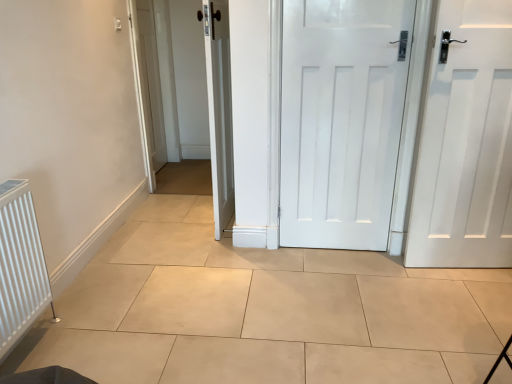
This screenshot has width=512, height=384. Describe the element at coordinates (219, 109) in the screenshot. I see `white wooden door at center, which is counted as the 3th door, starting from the right` at that location.

Find the location of `white matte door at center, the 2th door from the right`. white matte door at center, the 2th door from the right is located at coordinates (341, 120).

The height and width of the screenshot is (384, 512). What do you see at coordinates (20, 265) in the screenshot?
I see `white ribbed radiator at left` at bounding box center [20, 265].

You are a GUI agent. You are given a task and a screenshot of the screen. Output one action in this format:
    pyautogui.click(x=<x>, y=<y>)
    Task: Click on the white matte door at right, which is the 1th door in right-to-left order
    The height and width of the screenshot is (384, 512).
    Given the screenshot: What is the action you would take?
    pyautogui.click(x=465, y=141)

From the picture: Considering the relative sizes of white matte door at right, which is the 1th door in right-to-left order, and white wooden door at center, the 1th door in the left-to-right sequence, in the image provided, is white matte door at right, which is the 1th door in right-to-left order, shorter than white wooden door at center, the 1th door in the left-to-right sequence,?

Correct, white matte door at right, which is the 1th door in right-to-left order, is not as tall as white wooden door at center, the 1th door in the left-to-right sequence.

Which object is wider, white matte door at right, placed as the third door when sorted from left to right, or white wooden door at center, which is counted as the 3th door, starting from the right?

white wooden door at center, which is counted as the 3th door, starting from the right.

Would you say white matte door at right, which is the 1th door in right-to-left order, is inside or outside white wooden door at center, the 1th door in the left-to-right sequence?

white matte door at right, which is the 1th door in right-to-left order, cannot be found inside white wooden door at center, the 1th door in the left-to-right sequence.

Is white ribbed radiator at left smaller than white matte door at center, marked as the second door in a left-to-right arrangement?

Indeed, white ribbed radiator at left has a smaller size compared to white matte door at center, marked as the second door in a left-to-right arrangement.

From the image's perspective, between white ribbed radiator at left and white matte door at center, marked as the second door in a left-to-right arrangement, which one is located above?

white matte door at center, marked as the second door in a left-to-right arrangement, appears higher in the image.

Who is more distant, white ribbed radiator at left or white matte door at center, marked as the second door in a left-to-right arrangement?

white matte door at center, marked as the second door in a left-to-right arrangement, is behind.

Which object is positioned more to the left, white matte door at right, which is the 1th door in right-to-left order, or white matte door at center, the 2th door from the right?

From the viewer's perspective, white matte door at center, the 2th door from the right, appears more on the left side.

Is white matte door at right, which is the 1th door in right-to-left order, wider or thinner than white matte door at center, marked as the second door in a left-to-right arrangement?

white matte door at right, which is the 1th door in right-to-left order, is wider than white matte door at center, marked as the second door in a left-to-right arrangement.

From the image's perspective, is white matte door at right, which is the 1th door in right-to-left order, on white matte door at center, marked as the second door in a left-to-right arrangement?

Incorrect, from the image's perspective, white matte door at right, which is the 1th door in right-to-left order, is lower than white matte door at center, marked as the second door in a left-to-right arrangement.

Which door is the 3rd one when counting from the back of the white ribbed radiator at left? Please provide its 2D coordinates.

[(219, 109)]

Based on their positions, is white ribbed radiator at left located to the left or right of white wooden door at center, which is counted as the 3th door, starting from the right?

Clearly, white ribbed radiator at left is on the left of white wooden door at center, which is counted as the 3th door, starting from the right, in the image.

Is white ribbed radiator at left wider or thinner than white wooden door at center, the 1th door in the left-to-right sequence?

In the image, white ribbed radiator at left appears to be more narrow than white wooden door at center, the 1th door in the left-to-right sequence.

From a real-world perspective, is white ribbed radiator at left physically located above or below white wooden door at center, the 1th door in the left-to-right sequence?

white ribbed radiator at left is below white wooden door at center, the 1th door in the left-to-right sequence.

Consider the image. Considering the relative positions of white matte door at right, which is the 1th door in right-to-left order, and white ribbed radiator at left in the image provided, is white matte door at right, which is the 1th door in right-to-left order, to the left or to the right of white ribbed radiator at left?

From the image, it's evident that white matte door at right, which is the 1th door in right-to-left order, is to the right of white ribbed radiator at left.

Who is bigger, white matte door at right, placed as the third door when sorted from left to right, or white ribbed radiator at left?

white matte door at right, placed as the third door when sorted from left to right, is bigger.

Looking at this image, considering the sizes of objects white matte door at right, placed as the third door when sorted from left to right, and white ribbed radiator at left in the image provided, who is shorter, white matte door at right, placed as the third door when sorted from left to right, or white ribbed radiator at left?

With less height is white ribbed radiator at left.

Is white ribbed radiator at left bigger or smaller than white matte door at right, which is the 1th door in right-to-left order?

Considering their sizes, white ribbed radiator at left takes up less space than white matte door at right, which is the 1th door in right-to-left order.

Would you say white ribbed radiator at left is inside or outside white matte door at right, placed as the third door when sorted from left to right?

The correct answer is: outside.

Could you measure the distance between white ribbed radiator at left and white matte door at right, which is the 1th door in right-to-left order?

They are 2.09 meters apart.

Is white ribbed radiator at left to the left of white matte door at right, which is the 1th door in right-to-left order, from the viewer's perspective?

Correct, you'll find white ribbed radiator at left to the left of white matte door at right, which is the 1th door in right-to-left order.

Consider the image. Is white wooden door at center, which is counted as the 3th door, starting from the right, inside the boundaries of white matte door at center, the 2th door from the right, or outside?

white wooden door at center, which is counted as the 3th door, starting from the right, is outside white matte door at center, the 2th door from the right.

Considering their positions, is white wooden door at center, the 1th door in the left-to-right sequence, located in front of or behind white matte door at center, marked as the second door in a left-to-right arrangement?

In the image, white wooden door at center, the 1th door in the left-to-right sequence, appears behind white matte door at center, marked as the second door in a left-to-right arrangement.

From a real-world perspective, between white wooden door at center, which is counted as the 3th door, starting from the right, and white matte door at center, marked as the second door in a left-to-right arrangement, who is vertically lower?

white matte door at center, marked as the second door in a left-to-right arrangement.

Who is smaller, white wooden door at center, the 1th door in the left-to-right sequence, or white matte door at center, the 2th door from the right?

With smaller size is white matte door at center, the 2th door from the right.

From a real-world perspective, starting from the white matte door at right, placed as the third door when sorted from left to right, which door is the 2nd one vertically above it? Please provide its 2D coordinates.

[(219, 109)]

Find the location of `radiator in front of the white matte door at center, marked as the second door in a left-to-right arrangement`. radiator in front of the white matte door at center, marked as the second door in a left-to-right arrangement is located at coordinates (20, 265).

Which object lies nearer to the anchor point white matte door at right, placed as the third door when sorted from left to right, white wooden door at center, the 1th door in the left-to-right sequence, or white matte door at center, marked as the second door in a left-to-right arrangement?

white matte door at center, marked as the second door in a left-to-right arrangement, lies closer to white matte door at right, placed as the third door when sorted from left to right, than the other object.

When comparing their distances from white matte door at center, the 2th door from the right, does white matte door at right, placed as the third door when sorted from left to right, or white ribbed radiator at left seem further?

Based on the image, white ribbed radiator at left appears to be further to white matte door at center, the 2th door from the right.

Based on their spatial positions, is white ribbed radiator at left or white wooden door at center, which is counted as the 3th door, starting from the right, further from white matte door at center, marked as the second door in a left-to-right arrangement?

white ribbed radiator at left is further to white matte door at center, marked as the second door in a left-to-right arrangement.

Estimate the real-world distances between objects in this image. Which object is closer to white wooden door at center, which is counted as the 3th door, starting from the right, white ribbed radiator at left or white matte door at right, placed as the third door when sorted from left to right?

Among the two, white ribbed radiator at left is located nearer to white wooden door at center, which is counted as the 3th door, starting from the right.

Looking at the image, which one is located closer to white matte door at right, placed as the third door when sorted from left to right, white ribbed radiator at left or white matte door at center, the 2th door from the right?

white matte door at center, the 2th door from the right, lies closer to white matte door at right, placed as the third door when sorted from left to right, than the other object.

Looking at the image, which one is located closer to white wooden door at center, the 1th door in the left-to-right sequence, white matte door at center, marked as the second door in a left-to-right arrangement, or white ribbed radiator at left?

white matte door at center, marked as the second door in a left-to-right arrangement, lies closer to white wooden door at center, the 1th door in the left-to-right sequence, than the other object.

Looking at the image, which one is located closer to white ribbed radiator at left, white matte door at center, the 2th door from the right, or white wooden door at center, the 1th door in the left-to-right sequence?

Among the two, white wooden door at center, the 1th door in the left-to-right sequence, is located nearer to white ribbed radiator at left.

When comparing their distances from white matte door at right, placed as the third door when sorted from left to right, does white matte door at center, the 2th door from the right, or white wooden door at center, the 1th door in the left-to-right sequence, seem closer?

white matte door at center, the 2th door from the right.

What are the coordinates of `door located between white ribbed radiator at left and white matte door at center, marked as the second door in a left-to-right arrangement, in the left-right direction` in the screenshot? It's located at (219, 109).

Image resolution: width=512 pixels, height=384 pixels. Find the location of `door located between white wooden door at center, the 1th door in the left-to-right sequence, and white matte door at right, which is the 1th door in right-to-left order, in the left-right direction`. door located between white wooden door at center, the 1th door in the left-to-right sequence, and white matte door at right, which is the 1th door in right-to-left order, in the left-right direction is located at coordinates (341, 120).